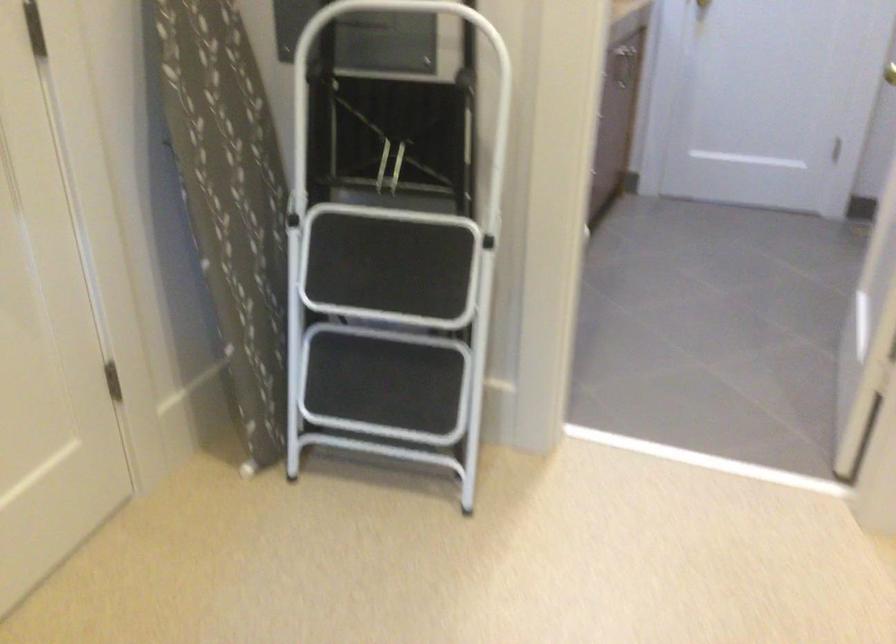
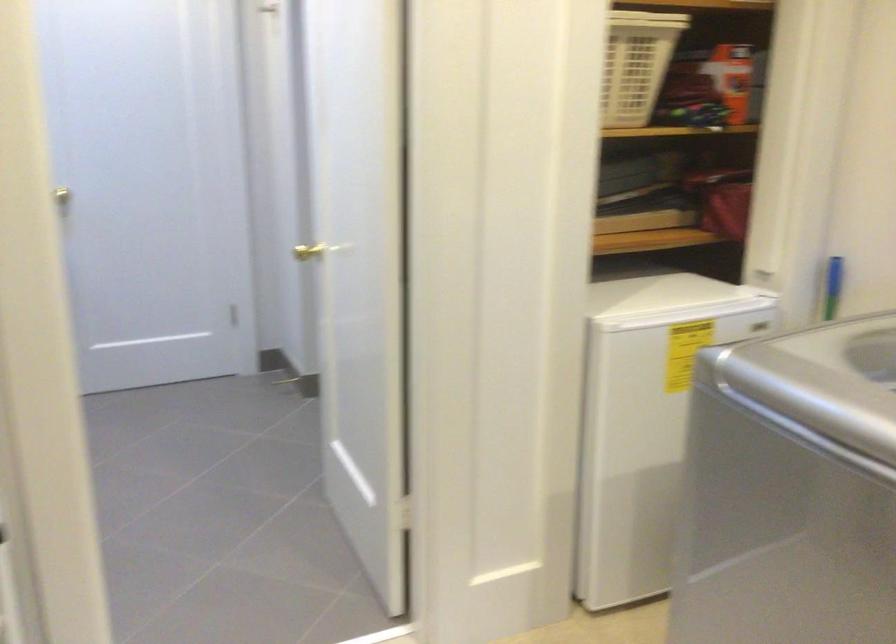
Question: The first image is from the beginning of the video and the second image is from the end. How did the camera likely rotate when shooting the video?

Choices:
 (A) Left
 (B) Right
 (C) Up
 (D) Down

Answer: (B)